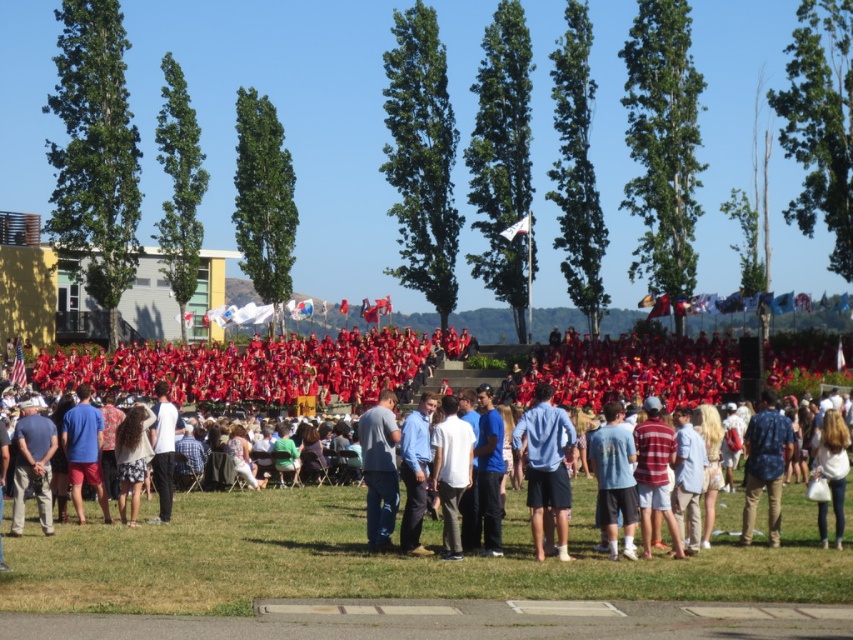
Between light blue denim shorts at center and blue jeans at center, which one has less height?

light blue denim shorts at center is shorter.

Who is higher up, light blue denim shorts at center or blue jeans at center?

blue jeans at center is higher up.

Is point (619, 468) positioned after point (379, 499)?

No, (619, 468) is closer to viewer.

I want to click on light blue denim shorts at center, so click(x=614, y=480).

Between blue jeans at center and blue denim jeans at lower left, which one is positioned higher?

Positioned higher is blue jeans at center.

Which is more to the left, blue jeans at center or blue denim jeans at lower left?

blue denim jeans at lower left

Where is `blue jeans at center`? blue jeans at center is located at coordinates (379, 468).

You are a GUI agent. You are given a task and a screenshot of the screen. Output one action in this format:
    pyautogui.click(x=<x>, y=<y>)
    Task: Click on the blue jeans at center
    The height and width of the screenshot is (640, 853).
    Given the screenshot: What is the action you would take?
    pyautogui.click(x=379, y=468)

Does point (566, 536) come behind point (155, 442)?

No, it is in front of (155, 442).

Consider the image. Who is more forward, (x=544, y=484) or (x=163, y=452)?

Point (x=544, y=484) is more forward.

Image resolution: width=853 pixels, height=640 pixels. What do you see at coordinates (544, 467) in the screenshot?
I see `light blue cotton shirt at center` at bounding box center [544, 467].

At what (x,y) coordinates should I click in order to perform the action: click on light blue cotton shirt at center. Please return your answer as a coordinate pair (x, y). Looking at the image, I should click on pos(544,467).